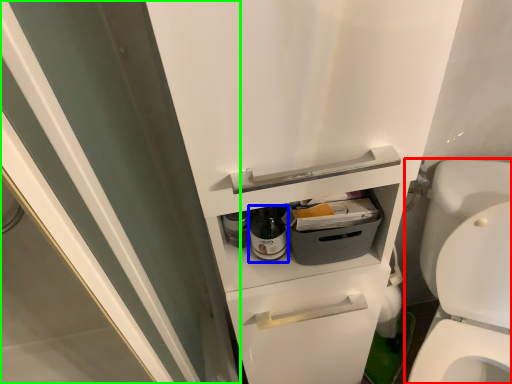
Question: Estimate the real-world distances between objects in this image. Which object is farther from toilet (highlighted by a red box), bottle (highlighted by a blue box) or screen door (highlighted by a green box)?

Choices:
 (A) bottle
 (B) screen door

Answer: (B)